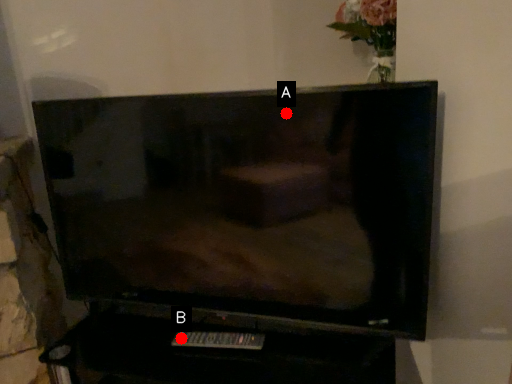
Question: Two points are circled on the image, labeled by A and B beside each circle. Which point appears farthest from the camera in this image?

Choices:
 (A) A is further
 (B) B is further

Answer: (B)